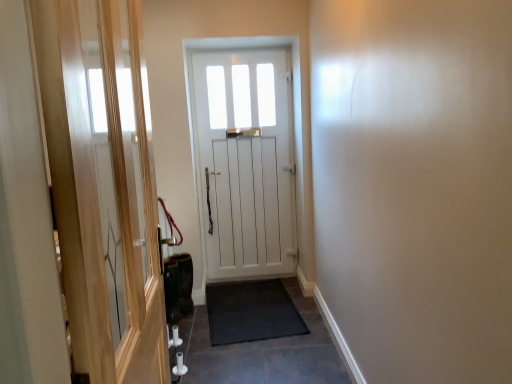
The width and height of the screenshot is (512, 384). I want to click on transparent glass screen door at left, so click(x=116, y=189).

Describe the element at coordinates (245, 160) in the screenshot. The image size is (512, 384). I see `white wooden door at center` at that location.

Image resolution: width=512 pixels, height=384 pixels. Describe the element at coordinates (251, 312) in the screenshot. I see `black rubber doormat at center` at that location.

At what (x,y) coordinates should I click in order to perform the action: click on black rubber mat at center. Please return your answer as a coordinate pair (x, y). Looking at the image, I should click on (263, 352).

The width and height of the screenshot is (512, 384). What are the coordinates of `transparent glass screen door at left` in the screenshot? It's located at (116, 189).

Is transparent glass screen door at left at the back of white wooden door at center?

No, white wooden door at center's orientation is not away from transparent glass screen door at left.

From a real-world perspective, is white wooden door at center above or below transparent glass screen door at left?

Clearly, from a real-world perspective, white wooden door at center is below transparent glass screen door at left.

The height and width of the screenshot is (384, 512). Identify the location of door behind the transparent glass screen door at left. (245, 160).

Is white wooden door at center to the right of black rubber mat at center from the viewer's perspective?

Incorrect, white wooden door at center is not on the right side of black rubber mat at center.

Is white wooden door at center in front of black rubber mat at center?

That is False.

Looking at this image, from their relative heights in the image, would you say white wooden door at center is taller or shorter than black rubber mat at center?

white wooden door at center is taller than black rubber mat at center.

Is white wooden door at center not close to black rubber mat at center?

Yes, white wooden door at center is far from black rubber mat at center.

Considering the relative positions of black rubber mat at center and white wooden door at center in the image provided, is black rubber mat at center behind white wooden door at center?

No, black rubber mat at center is closer to the viewer.

Is black rubber mat at center taller or shorter than white wooden door at center?

In the image, black rubber mat at center appears to be shorter than white wooden door at center.

Is black rubber mat at center next to white wooden door at center?

black rubber mat at center is not next to white wooden door at center, and they're not touching.

Is black rubber mat at center not within white wooden door at center?

black rubber mat at center is positioned outside white wooden door at center.

Does transparent glass screen door at left touch black rubber doormat at center?

transparent glass screen door at left and black rubber doormat at center are clearly separated.

Which of these two, transparent glass screen door at left or black rubber doormat at center, is thinner?

transparent glass screen door at left is thinner.

Which object is closer to the camera, transparent glass screen door at left or black rubber doormat at center?

transparent glass screen door at left is closer to the camera.

Is transparent glass screen door at left oriented away from black rubber doormat at center?

transparent glass screen door at left is not turned away from black rubber doormat at center.

Is black rubber doormat at center not close to black rubber mat at center?

That's not correct — black rubber doormat at center is a little close to black rubber mat at center.

Does black rubber doormat at center come behind black rubber mat at center?

Yes, black rubber doormat at center is further from the viewer.

Considering the positions of points (256, 321) and (212, 357), is point (256, 321) closer to camera compared to point (212, 357)?

No, it is behind (212, 357).

Is black rubber doormat at center facing towards black rubber mat at center?

Yes, black rubber doormat at center is oriented towards black rubber mat at center.

Is point (88, 16) behind point (337, 372)?

No, it is not.

This screenshot has width=512, height=384. I want to click on screen door on the left of black rubber mat at center, so click(x=116, y=189).

Does transparent glass screen door at left come behind black rubber mat at center?

No, it is in front of black rubber mat at center.

Is transparent glass screen door at left aimed at white wooden door at center?

No, transparent glass screen door at left is not facing towards white wooden door at center.

What's the angular difference between transparent glass screen door at left and white wooden door at center's facing directions?

There is a 91.2-degree angle between the facing directions of transparent glass screen door at left and white wooden door at center.

From the image's perspective, is transparent glass screen door at left located above white wooden door at center?

Actually, transparent glass screen door at left appears below white wooden door at center in the image.

Who is shorter, transparent glass screen door at left or white wooden door at center?

With less height is transparent glass screen door at left.

Locate an element on the screen. The height and width of the screenshot is (384, 512). door on the right side of transparent glass screen door at left is located at coordinates (245, 160).

You are a GUI agent. You are given a task and a screenshot of the screen. Output one action in this format:
    pyautogui.click(x=<x>, y=<y>)
    Task: Click on the path beneath the white wooden door at center (from a real-world perspective)
    This screenshot has height=384, width=512.
    Given the screenshot: What is the action you would take?
    pyautogui.click(x=263, y=352)

Looking at the image, which one is located closer to black rubber doormat at center, transparent glass screen door at left or black rubber mat at center?

black rubber mat at center is closer to black rubber doormat at center.

When comparing their distances from black rubber mat at center, does transparent glass screen door at left or black rubber doormat at center seem further?

transparent glass screen door at left lies further to black rubber mat at center than the other object.

Considering their positions, is black rubber doormat at center positioned further to white wooden door at center than black rubber mat at center?

black rubber mat at center lies further to white wooden door at center than the other object.

When comparing their distances from white wooden door at center, does black rubber mat at center or black rubber doormat at center seem further?

black rubber mat at center lies further to white wooden door at center than the other object.

Which object lies further to the anchor point transparent glass screen door at left, black rubber doormat at center or black rubber mat at center?

black rubber doormat at center lies further to transparent glass screen door at left than the other object.

Based on the photo, when comparing their distances from black rubber doormat at center, does black rubber mat at center or white wooden door at center seem further?

white wooden door at center lies further to black rubber doormat at center than the other object.

Estimate the real-world distances between objects in this image. Which object is closer to transparent glass screen door at left, white wooden door at center or black rubber mat at center?

black rubber mat at center.

Based on their spatial positions, is black rubber mat at center or transparent glass screen door at left further from white wooden door at center?

Among the two, transparent glass screen door at left is located further to white wooden door at center.

The image size is (512, 384). Find the location of `doormat that lies between white wooden door at center and black rubber mat at center from top to bottom`. doormat that lies between white wooden door at center and black rubber mat at center from top to bottom is located at coordinates (251, 312).

The image size is (512, 384). I want to click on doormat positioned between transparent glass screen door at left and white wooden door at center from near to far, so click(x=251, y=312).

At what (x,y) coordinates should I click in order to perform the action: click on path positioned between transparent glass screen door at left and white wooden door at center from near to far. Please return your answer as a coordinate pair (x, y). Looking at the image, I should click on (263, 352).

The height and width of the screenshot is (384, 512). I want to click on path located between transparent glass screen door at left and black rubber doormat at center in the depth direction, so click(x=263, y=352).